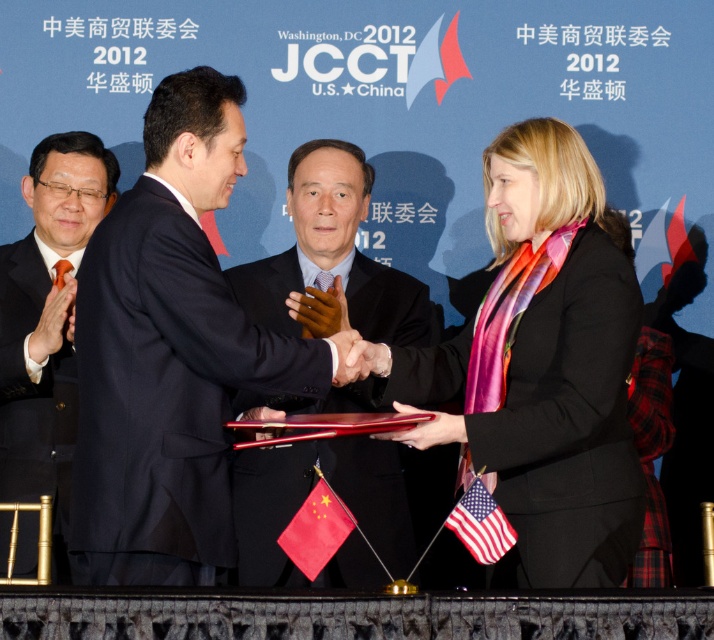
Can you confirm if black silk scarf at center is positioned above black suit at left?

Incorrect, black silk scarf at center is not positioned above black suit at left.

Does black silk scarf at center lie in front of black suit at left?

That is True.

Identify the location of black silk scarf at center. The height and width of the screenshot is (640, 714). (540, 365).

Where is `black silk scarf at center`? black silk scarf at center is located at coordinates (540, 365).

Where is `black suit at center`? black suit at center is located at coordinates (170, 353).

Can you confirm if black suit at center is positioned below black suit at left?

No.

Does point (169, 284) come behind point (66, 579)?

That is False.

Where is `black suit at center`? black suit at center is located at coordinates (170, 353).

Does black suit at center have a larger size compared to dark blue suit at center?

Correct, black suit at center is larger in size than dark blue suit at center.

Between point (188, 260) and point (331, 324), which one is positioned in front?

Point (188, 260) is more forward.

Is point (169, 276) closer to viewer compared to point (261, 403)?

Yes, it is.

I want to click on black suit at center, so (x=170, y=353).